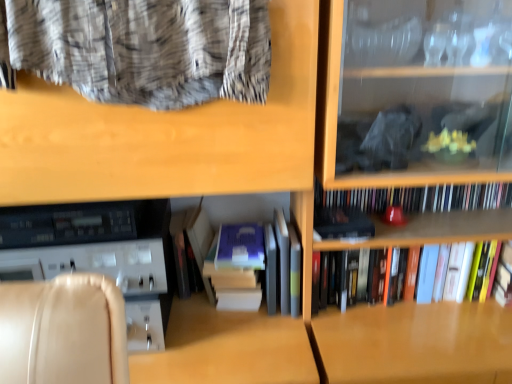
Question: Is matte black book at center, marked as the first paperback book in a right-to-left arrangement, oriented towards hardcover book at center, marked as the 2th book in a top-to-bottom arrangement?

Choices:
 (A) no
 (B) yes

Answer: (A)

Question: Is matte black book at center, the second paperback book viewed from the left, facing away from hardcover book at center, arranged as the 2th book when ordered from the bottom?

Choices:
 (A) yes
 (B) no

Answer: (B)

Question: Can you confirm if matte black book at center, the second paperback book viewed from the left, is shorter than hardcover book at center, marked as the 2th book in a top-to-bottom arrangement?

Choices:
 (A) yes
 (B) no

Answer: (A)

Question: Is matte black book at center, marked as the first paperback book in a right-to-left arrangement, positioned beyond the bounds of hardcover book at center, arranged as the 2th book when ordered from the bottom?

Choices:
 (A) no
 (B) yes

Answer: (B)

Question: From a real-world perspective, is matte black book at center, the second paperback book viewed from the left, located beneath hardcover book at center, marked as the 2th book in a top-to-bottom arrangement?

Choices:
 (A) no
 (B) yes

Answer: (A)

Question: Considering their positions, is hardcover books at center, the first book positioned from the top, located in front of or behind hardcover books at center, which is the 1th book in bottom-to-top order?

Choices:
 (A) behind
 (B) front

Answer: (A)

Question: From the image's perspective, is hardcover books at center, which appears as the third book when ordered from the bottom, positioned above or below hardcover books at center, which is the 1th book in bottom-to-top order?

Choices:
 (A) below
 (B) above

Answer: (B)

Question: In the image, is hardcover books at center, the first book positioned from the top, on the left side or the right side of hardcover books at center, which is the 1th book in bottom-to-top order?

Choices:
 (A) right
 (B) left

Answer: (A)

Question: Considering the positions of point (401, 193) and point (364, 248), is point (401, 193) closer or farther from the camera than point (364, 248)?

Choices:
 (A) farther
 (B) closer

Answer: (A)

Question: Considering their positions, is matte black book at center, marked as the first paperback book in a right-to-left arrangement, located in front of or behind hardcover books at center, which appears as the third book when ordered from the bottom?

Choices:
 (A) front
 (B) behind

Answer: (A)

Question: In terms of width, does matte black book at center, the second paperback book viewed from the left, look wider or thinner when compared to hardcover books at center, the first book positioned from the top?

Choices:
 (A) thin
 (B) wide

Answer: (B)

Question: Is matte black book at center, the second paperback book viewed from the left, inside or outside of hardcover books at center, which appears as the third book when ordered from the bottom?

Choices:
 (A) outside
 (B) inside

Answer: (A)

Question: Looking at the image, does matte black book at center, marked as the first paperback book in a right-to-left arrangement, seem bigger or smaller compared to hardcover books at center, which appears as the third book when ordered from the bottom?

Choices:
 (A) big
 (B) small

Answer: (B)

Question: Looking at their shapes, would you say matte black book at center, marked as the first paperback book in a right-to-left arrangement, is wider or thinner than hardcover books at center, which is the 1th book in bottom-to-top order?

Choices:
 (A) thin
 (B) wide

Answer: (B)

Question: Is matte black book at center, the second paperback book viewed from the left, situated inside hardcover books at center, which is the 1th book in bottom-to-top order, or outside?

Choices:
 (A) inside
 (B) outside

Answer: (B)